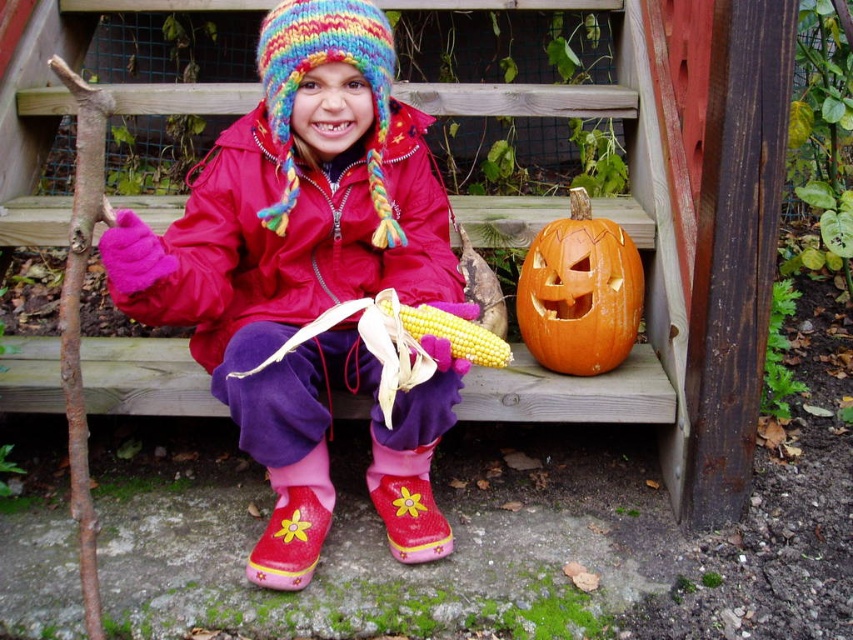
Question: Where is matte pink rubber boots at center located in relation to orange matte pumpkin at lower right in the image?

Choices:
 (A) above
 (B) below

Answer: (B)

Question: Is matte pink rubber boots at center positioned at the back of orange matte pumpkin at lower right?

Choices:
 (A) yes
 (B) no

Answer: (B)

Question: Which point appears closest to the camera in this image?

Choices:
 (A) (618, 332)
 (B) (291, 472)

Answer: (B)

Question: Is matte pink rubber boots at center closer to camera compared to orange matte pumpkin at lower right?

Choices:
 (A) no
 (B) yes

Answer: (B)